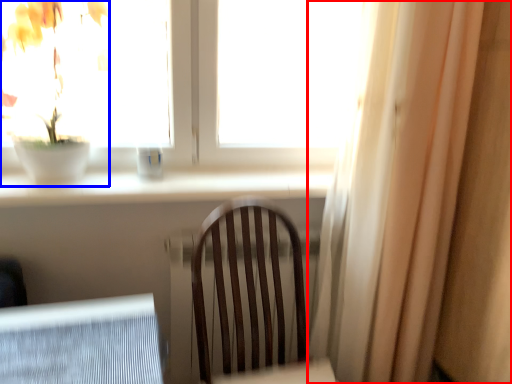
Question: Among these objects, which one is nearest to the camera, curtain (highlighted by a red box) or houseplant (highlighted by a blue box)?

Choices:
 (A) curtain
 (B) houseplant

Answer: (A)